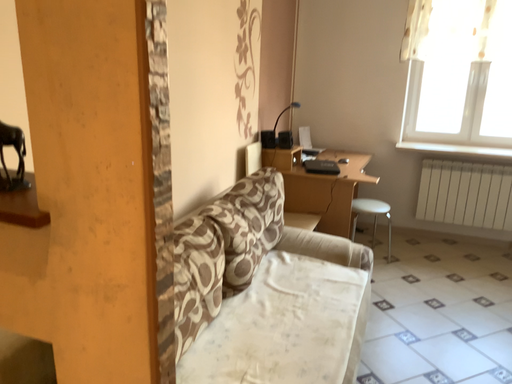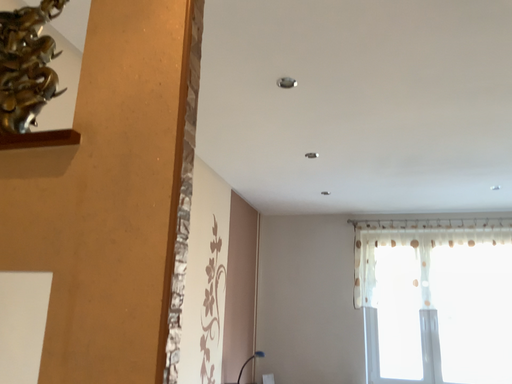
Question: Which way did the camera rotate in the video?

Choices:
 (A) rotated upward
 (B) rotated downward

Answer: (A)